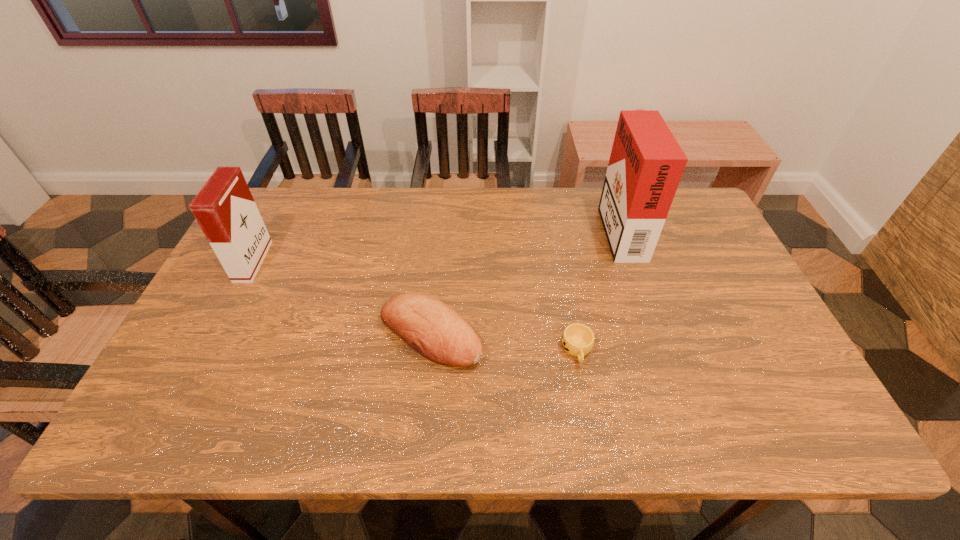
You are a GUI agent. You are given a task and a screenshot of the screen. Output one action in this format:
    pyautogui.click(x=<x>, y=<y>)
    Task: Click on the vacant point at the far left corner
    This screenshot has height=540, width=960.
    Given the screenshot: What is the action you would take?
    [x=298, y=204]

Where is `vacant space in between the right cigarette_case and the left cigarette_case`? vacant space in between the right cigarette_case and the left cigarette_case is located at coordinates (437, 245).

I want to click on empty space between the right cigarette_case and the bread, so click(525, 281).

You are a GUI agent. You are given a task and a screenshot of the screen. Output one action in this format:
    pyautogui.click(x=<x>, y=<y>)
    Task: Click on the vacant point located between the second object from right to left and the tallest object
    The height and width of the screenshot is (540, 960).
    Given the screenshot: What is the action you would take?
    pyautogui.click(x=598, y=289)

The height and width of the screenshot is (540, 960). I want to click on unoccupied position between the third object from left to right and the rightmost object, so click(x=598, y=289).

Identify the location of free spot between the third shortest object and the rightmost object. This screenshot has width=960, height=540. (437, 245).

Where is `empty location between the shortest object and the taller cigarette_case`? The width and height of the screenshot is (960, 540). empty location between the shortest object and the taller cigarette_case is located at coordinates (598, 289).

I want to click on free space between the third object from right to left and the left cigarette_case, so click(x=342, y=298).

Locate an element on the screen. empty space that is in between the taller cigarette_case and the second shortest object is located at coordinates (525, 281).

Locate an element on the screen. The height and width of the screenshot is (540, 960). free space between the right cigarette_case and the second object from left to right is located at coordinates (525, 281).